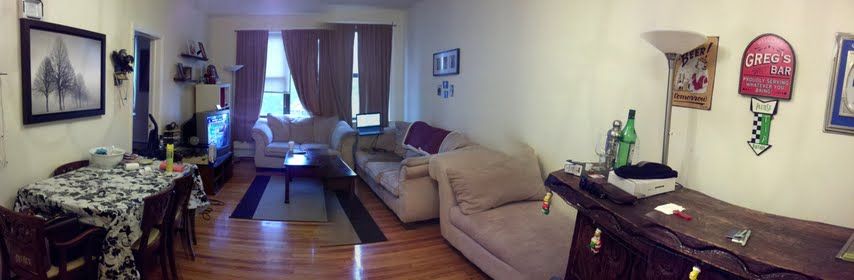
This screenshot has height=280, width=854. I want to click on chairs, so click(37, 242), click(155, 219), click(178, 190), click(68, 165).